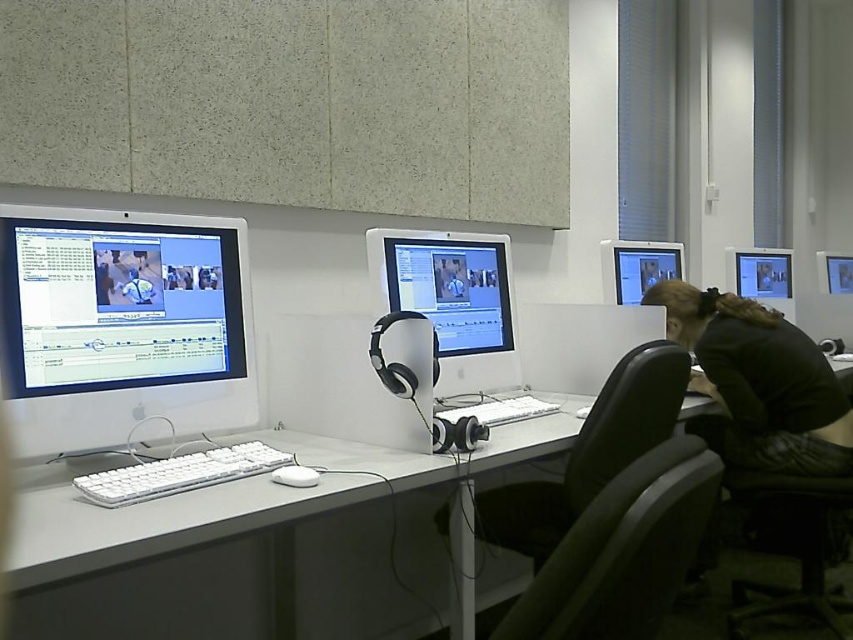
You are a visitor in this workspace and want to pick up the black leather jacket at lower right without touching the matte black monitor at right. Is it possible to do so?

The black leather jacket at lower right is closer to the viewer than the matte black monitor at right, so yes, you can pick up the black leather jacket at lower right without touching the matte black monitor at right since it is farther away.

You are setting up a new workstation in the office. You have a white plastic keyboard at center and a matte black monitor at upper right. Where should you place the keyboard relative to the monitor to match the existing setup?

The white plastic keyboard at center should be placed on the left side of the matte black monitor at upper right to match the existing setup.